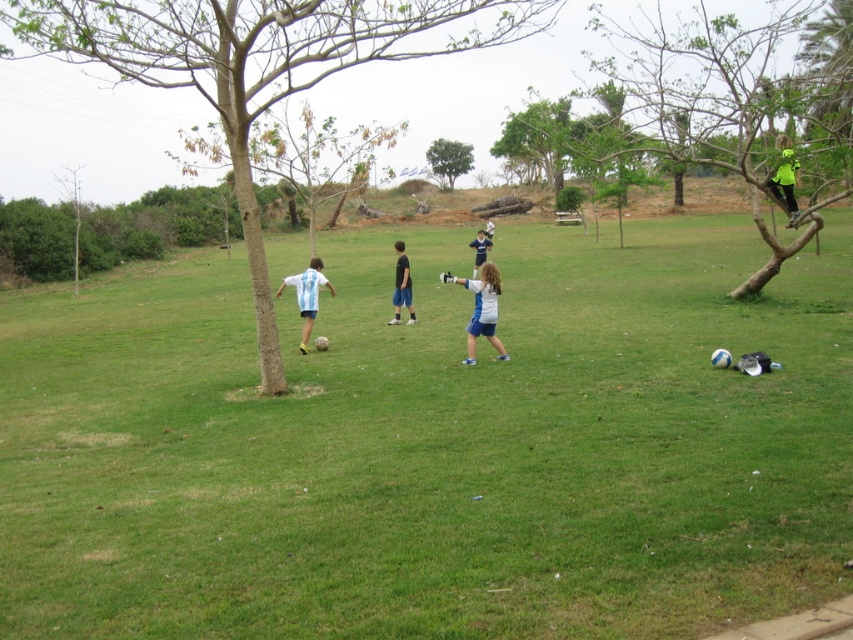
Is point (283, 280) more distant than point (490, 236)?

No, it is in front of (490, 236).

The height and width of the screenshot is (640, 853). What do you see at coordinates (306, 296) in the screenshot? I see `white matte soccer ball at lower center` at bounding box center [306, 296].

Locate an element on the screen. The width and height of the screenshot is (853, 640). white matte soccer ball at lower center is located at coordinates (306, 296).

Between point (833, 10) and point (473, 264), which one is positioned behind?

Positioned behind is point (833, 10).

Does point (741, 52) come in front of point (480, 253)?

No.

Where is `green leafy tree at upper right`? This screenshot has width=853, height=640. green leafy tree at upper right is located at coordinates (741, 102).

Can you confirm if white matte shirt at center is taller than white matte soccer ball at lower center?

Incorrect, white matte shirt at center's height is not larger of white matte soccer ball at lower center's.

Who is more forward, [471,321] or [294,275]?

Point [471,321]

Is point (474, 321) positioned after point (306, 336)?

No.

The height and width of the screenshot is (640, 853). I want to click on white matte shirt at center, so click(480, 308).